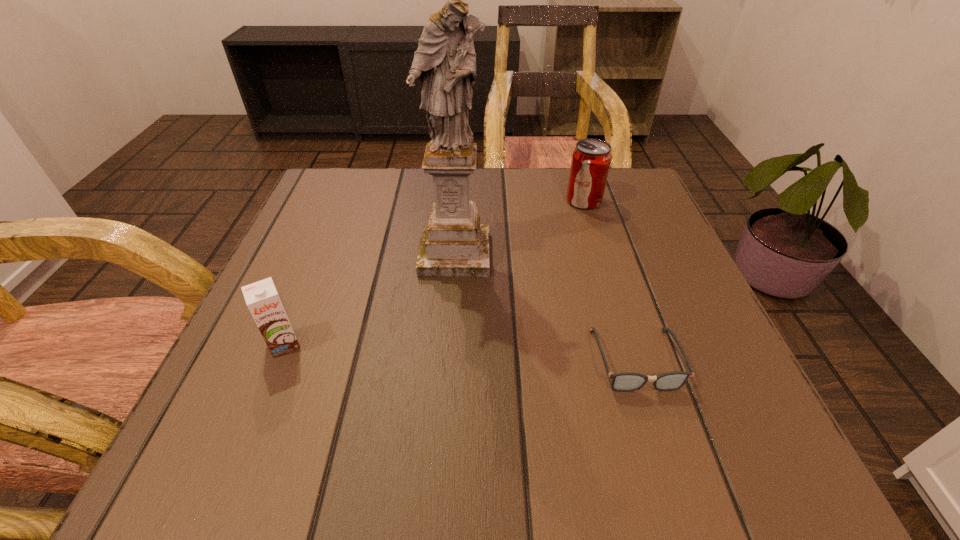
The image size is (960, 540). Identify the location of the third nearest object. [454, 244].

This screenshot has height=540, width=960. What are the coordinates of `the third object from right to left` in the screenshot? It's located at (454, 244).

Identify the location of the farthest object. (591, 159).

The height and width of the screenshot is (540, 960). Identify the location of the leftmost object. (262, 299).

Find the location of a particular element. This screenshot has width=960, height=540. the shortest object is located at coordinates (626, 381).

Identify the location of free space located 0.140m on the front-facing side of the sculpture. The width and height of the screenshot is (960, 540). (449, 336).

Identify the location of vacant space positioned 0.360m on the left of the pop soda. This screenshot has height=540, width=960. (407, 201).

Identify the location of vacant space located 0.300m on the back of the chocolate milk. (334, 222).

I want to click on vacant space located on the face of the spectacles, so click(x=659, y=433).

Locate an element on the screen. The height and width of the screenshot is (540, 960). object positioned at the far edge is located at coordinates pos(591,159).